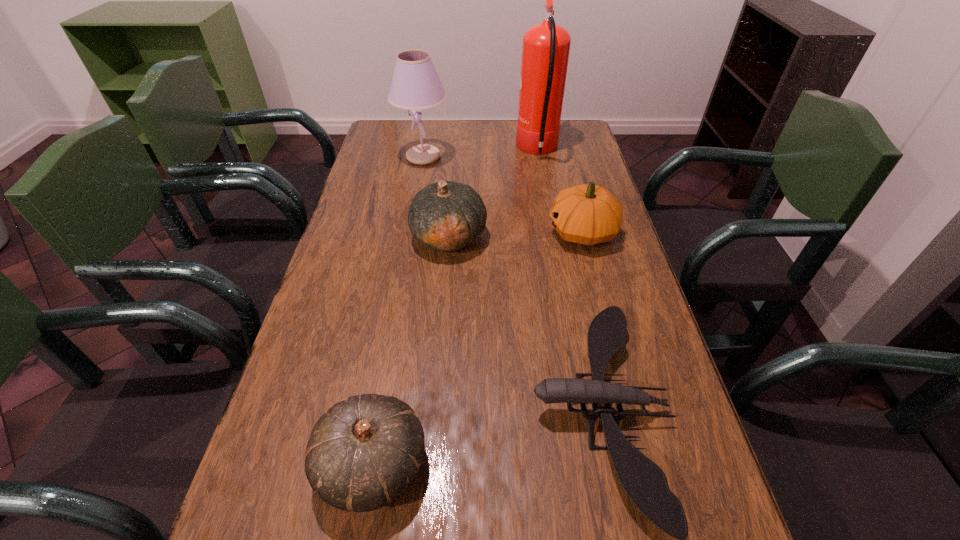
Identify the location of free region located on the side of the rightmost gourd with the carved face. (427, 232).

Locate an element on the screen. The height and width of the screenshot is (540, 960). blank space located 0.120m on the back of the nearest gourd is located at coordinates (391, 362).

The image size is (960, 540). What are the coordinates of `fire extinguisher located in the far edge section of the desktop` in the screenshot? It's located at (545, 48).

This screenshot has height=540, width=960. What are the coordinates of `lampshade at the far edge` in the screenshot? It's located at (415, 85).

This screenshot has height=540, width=960. What are the coordinates of `lampshade positioned at the left edge` in the screenshot? It's located at (415, 85).

At what (x,y) coordinates should I click in order to perform the action: click on gourd that is at the left edge. Please return your answer as a coordinate pair (x, y). The width and height of the screenshot is (960, 540). Looking at the image, I should click on (364, 452).

I want to click on fire extinguisher positioned at the right edge, so click(x=545, y=48).

At what (x,y) coordinates should I click in order to perform the action: click on gourd that is at the right edge. Please return your answer as a coordinate pair (x, y). Looking at the image, I should click on (x=587, y=214).

At what (x,y) coordinates should I click in order to perform the action: click on object that is at the far left corner. Please return your answer as a coordinate pair (x, y). This screenshot has width=960, height=540. Looking at the image, I should click on (415, 85).

This screenshot has width=960, height=540. What are the coordinates of `object located at the far right corner` in the screenshot? It's located at (545, 48).